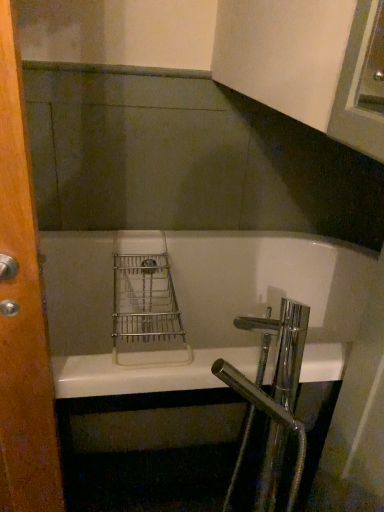
What do you see at coordinates (22, 311) in the screenshot? This screenshot has width=384, height=512. I see `wooden door at left` at bounding box center [22, 311].

At what (x,y) coordinates should I click in order to perform the action: click on wooden door at left. Please return your answer as a coordinate pair (x, y). Image resolution: width=384 pixels, height=512 pixels. Looking at the image, I should click on (22, 311).

This screenshot has height=512, width=384. Describe the element at coordinates (192, 305) in the screenshot. I see `white glossy bathtub at center` at that location.

Where is `wooden door at left`? The height and width of the screenshot is (512, 384). wooden door at left is located at coordinates (22, 311).

Which of these two, chrome/metallic faucet at lower right or white glossy bathtub at center, is smaller?

Smaller between the two is chrome/metallic faucet at lower right.

Is chrome/metallic faucet at lower right aimed at white glossy bathtub at center?

No, chrome/metallic faucet at lower right does not turn towards white glossy bathtub at center.

Who is taller, chrome/metallic faucet at lower right or white glossy bathtub at center?

chrome/metallic faucet at lower right is taller.

Considering the positions of point (300, 344) and point (169, 362), is point (300, 344) closer or farther from the camera than point (169, 362)?

Clearly, point (300, 344) is more distant from the camera than point (169, 362).

Does chrome/metallic faucet at lower right turn towards wooden door at left?

Yes.

In the scene shown: Between chrome/metallic faucet at lower right and wooden door at left, which one is positioned behind?

chrome/metallic faucet at lower right.

Which point is more forward, (239,320) or (8,478)?

Point (239,320)

Can you tell me how much chrome/metallic faucet at lower right and wooden door at left differ in facing direction?

The facing directions of chrome/metallic faucet at lower right and wooden door at left are 90.4 degrees apart.

Is point (8, 392) farther from camera compared to point (295, 465)?

No, (8, 392) is closer to viewer.

Between wooden door at left and chrome/metallic faucet at lower right, which one has larger size?

Bigger between the two is chrome/metallic faucet at lower right.

Is wooden door at left looking in the opposite direction of chrome/metallic faucet at lower right?

No, wooden door at left is not facing away from chrome/metallic faucet at lower right.

From a real-world perspective, is wooden door at left physically above chrome/metallic faucet at lower right?

Correct, in the physical world, wooden door at left is higher than chrome/metallic faucet at lower right.

Considering the sizes of white glossy bathtub at center and wooden door at left in the image, is white glossy bathtub at center bigger or smaller than wooden door at left?

white glossy bathtub at center is bigger than wooden door at left.

Is white glossy bathtub at center beside wooden door at left?

white glossy bathtub at center and wooden door at left are not in contact.

Does white glossy bathtub at center have a lesser width compared to wooden door at left?

No.

Is white glossy bathtub at center inside wooden door at left?

No, white glossy bathtub at center is not surrounded by wooden door at left.

Looking at the image, does wooden door at left seem bigger or smaller compared to white glossy bathtub at center?

wooden door at left is smaller than white glossy bathtub at center.

Is wooden door at left with white glossy bathtub at center?

They are not placed beside each other.

Considering the relative sizes of wooden door at left and white glossy bathtub at center in the image provided, is wooden door at left thinner than white glossy bathtub at center?

Yes.

What's the angular difference between white glossy bathtub at center and chrome/metallic faucet at lower right's facing directions?

90.9 degrees.

Do you think white glossy bathtub at center is within chrome/metallic faucet at lower right, or outside of it?

white glossy bathtub at center exists outside the volume of chrome/metallic faucet at lower right.

Is white glossy bathtub at center to the left of chrome/metallic faucet at lower right from the viewer's perspective?

Yes.

Does point (183, 313) appear closer or farther from the camera than point (238, 473)?

Clearly, point (183, 313) is more distant from the camera than point (238, 473).

Image resolution: width=384 pixels, height=512 pixels. I want to click on bathtub on the left of chrome/metallic faucet at lower right, so click(192, 305).

This screenshot has width=384, height=512. Find the location of `screen door in front of the chrome/metallic faucet at lower right`. screen door in front of the chrome/metallic faucet at lower right is located at coordinates (22, 311).

Considering their positions, is white glossy bathtub at center positioned further to wooden door at left than chrome/metallic faucet at lower right?

white glossy bathtub at center is positioned further to the anchor wooden door at left.

Which object lies further to the anchor point white glossy bathtub at center, wooden door at left or chrome/metallic faucet at lower right?

wooden door at left lies further to white glossy bathtub at center than the other object.

From the image, which object appears to be nearer to chrome/metallic faucet at lower right, wooden door at left or white glossy bathtub at center?

The object closer to chrome/metallic faucet at lower right is wooden door at left.

When comparing their distances from white glossy bathtub at center, does chrome/metallic faucet at lower right or wooden door at left seem further?

wooden door at left is further to white glossy bathtub at center.

Considering their positions, is chrome/metallic faucet at lower right positioned further to wooden door at left than white glossy bathtub at center?

white glossy bathtub at center.

Looking at this image, which object lies nearer to the anchor point chrome/metallic faucet at lower right, white glossy bathtub at center or wooden door at left?

Among the two, wooden door at left is located nearer to chrome/metallic faucet at lower right.

This screenshot has height=512, width=384. I want to click on bathtub between wooden door at left and chrome/metallic faucet at lower right in the horizontal direction, so point(192,305).